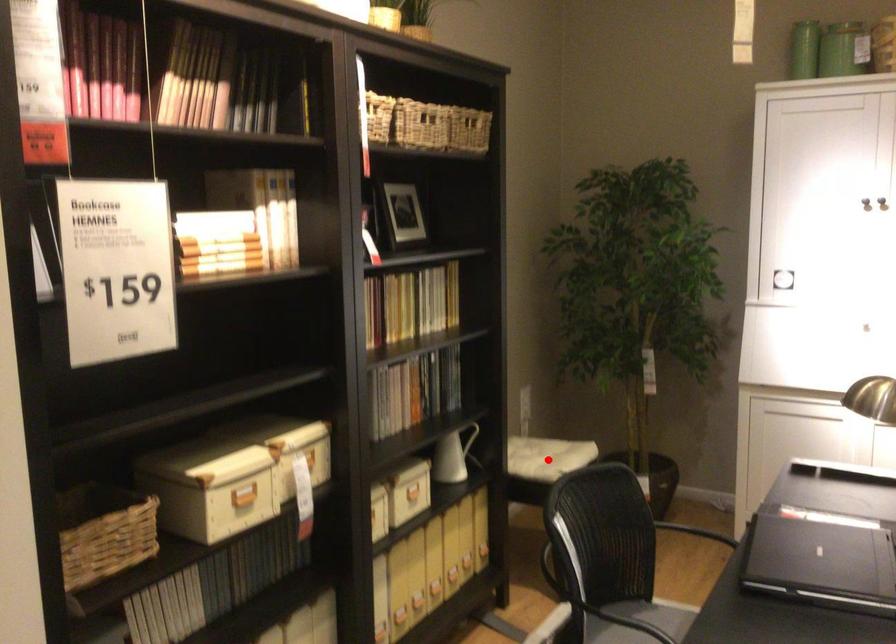
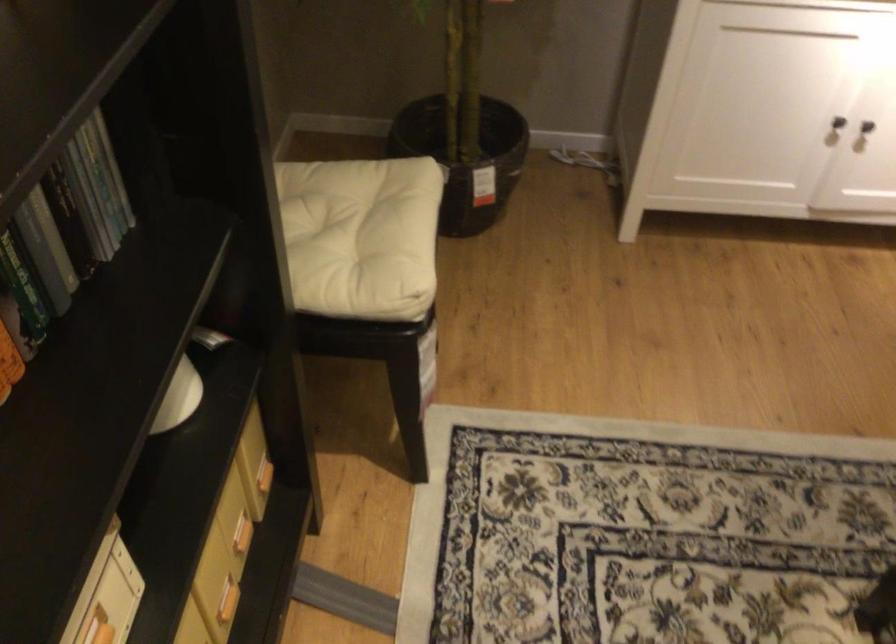
Question: I am providing you with two images of the same scene from different viewpoints. In image1, a red point is highlighted. Considering the same 3D point in image2, which of the following is correct?

Choices:
 (A) It is closer
 (B) It is farther

Answer: (A)